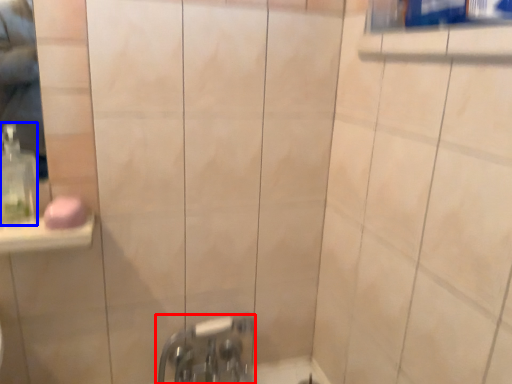
Question: Among these objects, which one is nearest to the camera, tap (highlighted by a red box) or soap dispenser (highlighted by a blue box)?

Choices:
 (A) tap
 (B) soap dispenser

Answer: (B)